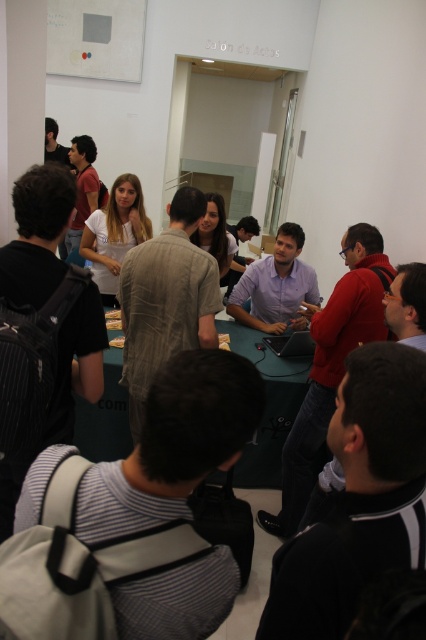
Question: Which of the following is the closest to the observer?

Choices:
 (A) (146, 225)
 (B) (287, 374)
 (C) (123, 337)

Answer: (B)

Question: Which object is farther from the camera taking this photo?

Choices:
 (A) smooth wooden board at center
 (B) green fabric table at center
 (C) light brown hair at center

Answer: (C)

Question: Is light brown hair at center positioned in front of smooth wooden board at center?

Choices:
 (A) no
 (B) yes

Answer: (A)

Question: Can you confirm if green fabric table at center is thinner than light brown hair at center?

Choices:
 (A) yes
 (B) no

Answer: (B)

Question: Which of these objects is positioned closest to the green fabric table at center?

Choices:
 (A) smooth wooden board at center
 (B) light brown hair at center

Answer: (A)

Question: Can you confirm if light brown hair at center is smaller than smooth wooden board at center?

Choices:
 (A) yes
 (B) no

Answer: (B)